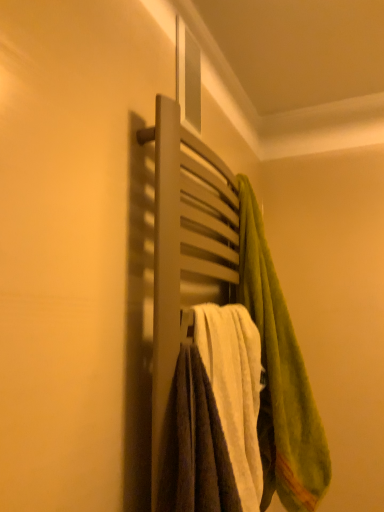
Identify the location of green fuzzy towel at upper right, acting as the 1th towel starting from the right. (280, 376).

What's the angular difference between green fuzzy towel at upper right, acting as the second towel starting from the left, and white soft towel at center, marked as the first towel in a left-to-right arrangement,'s facing directions?

green fuzzy towel at upper right, acting as the second towel starting from the left, and white soft towel at center, marked as the first towel in a left-to-right arrangement, are facing 0.000337 degrees away from each other.

Considering the relative positions of green fuzzy towel at upper right, acting as the second towel starting from the left, and white soft towel at center, marked as the first towel in a left-to-right arrangement, in the image provided, is green fuzzy towel at upper right, acting as the second towel starting from the left, to the left of white soft towel at center, marked as the first towel in a left-to-right arrangement, from the viewer's perspective?

In fact, green fuzzy towel at upper right, acting as the second towel starting from the left, is to the right of white soft towel at center, marked as the first towel in a left-to-right arrangement.

Considering the sizes of objects green fuzzy towel at upper right, acting as the 1th towel starting from the right, and white soft towel at center, marked as the first towel in a left-to-right arrangement, in the image provided, who is wider, green fuzzy towel at upper right, acting as the 1th towel starting from the right, or white soft towel at center, marked as the first towel in a left-to-right arrangement,?

green fuzzy towel at upper right, acting as the 1th towel starting from the right.

Identify the location of towel below the green fuzzy towel at upper right, acting as the second towel starting from the left (from the image's perspective). (234, 388).

In the scene shown: Does matte wooden towel rack at center have a greater width compared to white soft towel at center, marked as the first towel in a left-to-right arrangement?

In fact, matte wooden towel rack at center might be narrower than white soft towel at center, marked as the first towel in a left-to-right arrangement.

Between matte wooden towel rack at center and white soft towel at center, acting as the 2th towel starting from the right, which one has more height?

matte wooden towel rack at center is taller.

Is matte wooden towel rack at center at the left side of white soft towel at center, marked as the first towel in a left-to-right arrangement?

Indeed, matte wooden towel rack at center is positioned on the left side of white soft towel at center, marked as the first towel in a left-to-right arrangement.

Based on the photo, which of these two, white soft towel at center, marked as the first towel in a left-to-right arrangement, or matte wooden towel rack at center, is thinner?

With smaller width is matte wooden towel rack at center.

Which of these two, white soft towel at center, acting as the 2th towel starting from the right, or matte wooden towel rack at center, stands taller?

With more height is matte wooden towel rack at center.

Which object is more forward, white soft towel at center, marked as the first towel in a left-to-right arrangement, or matte wooden towel rack at center?

matte wooden towel rack at center is closer to the camera.

Is there a large distance between white soft towel at center, acting as the 2th towel starting from the right, and matte wooden towel rack at center?

No, white soft towel at center, acting as the 2th towel starting from the right, is not far away from matte wooden towel rack at center.

Does green fuzzy towel at upper right, acting as the second towel starting from the left, have a smaller size compared to matte wooden towel rack at center?

Yes.

From a real-world perspective, which object stands above the other?

In real-world perspective, matte wooden towel rack at center is above.

Which point is more forward, (266, 314) or (189, 203)?

The point (189, 203) is closer to the camera.

Looking at this image, is matte wooden towel rack at center located within green fuzzy towel at upper right, acting as the second towel starting from the left?

No, matte wooden towel rack at center is not inside green fuzzy towel at upper right, acting as the second towel starting from the left.

Is white soft towel at center, acting as the 2th towel starting from the right, oriented away from green fuzzy towel at upper right, acting as the 1th towel starting from the right?

white soft towel at center, acting as the 2th towel starting from the right, does not have its back to green fuzzy towel at upper right, acting as the 1th towel starting from the right.

Considering the sizes of white soft towel at center, acting as the 2th towel starting from the right, and green fuzzy towel at upper right, acting as the second towel starting from the left, in the image, is white soft towel at center, acting as the 2th towel starting from the right, wider or thinner than green fuzzy towel at upper right, acting as the second towel starting from the left,?

Clearly, white soft towel at center, acting as the 2th towel starting from the right, has less width compared to green fuzzy towel at upper right, acting as the second towel starting from the left.

From their relative heights in the image, would you say white soft towel at center, acting as the 2th towel starting from the right, is taller or shorter than green fuzzy towel at upper right, acting as the 1th towel starting from the right?

Clearly, white soft towel at center, acting as the 2th towel starting from the right, is shorter compared to green fuzzy towel at upper right, acting as the 1th towel starting from the right.

Is white soft towel at center, acting as the 2th towel starting from the right, to the left of green fuzzy towel at upper right, acting as the 1th towel starting from the right, from the viewer's perspective?

Yes, white soft towel at center, acting as the 2th towel starting from the right, is to the left of green fuzzy towel at upper right, acting as the 1th towel starting from the right.

Considering the relative sizes of matte wooden towel rack at center and green fuzzy towel at upper right, acting as the 1th towel starting from the right, in the image provided, is matte wooden towel rack at center bigger than green fuzzy towel at upper right, acting as the 1th towel starting from the right,?

Correct, matte wooden towel rack at center is larger in size than green fuzzy towel at upper right, acting as the 1th towel starting from the right.

Is matte wooden towel rack at center completely or partially outside of green fuzzy towel at upper right, acting as the 1th towel starting from the right?

Yes, matte wooden towel rack at center is located beyond the bounds of green fuzzy towel at upper right, acting as the 1th towel starting from the right.

Is matte wooden towel rack at center shorter than green fuzzy towel at upper right, acting as the second towel starting from the left?

Correct, matte wooden towel rack at center is not as tall as green fuzzy towel at upper right, acting as the second towel starting from the left.

You are a GUI agent. You are given a task and a screenshot of the screen. Output one action in this format:
    pyautogui.click(x=<x>, y=<y>)
    Task: Click on the towel on the right of white soft towel at center, acting as the 2th towel starting from the right
    The height and width of the screenshot is (512, 384).
    Given the screenshot: What is the action you would take?
    pyautogui.click(x=280, y=376)

Locate an element on the screen. This screenshot has width=384, height=512. towel that is the 2nd object located below the matte wooden towel rack at center (from the image's perspective) is located at coordinates pos(234,388).

Estimate the real-world distances between objects in this image. Which object is further from matte wooden towel rack at center, green fuzzy towel at upper right, acting as the second towel starting from the left, or white soft towel at center, marked as the first towel in a left-to-right arrangement?

green fuzzy towel at upper right, acting as the second towel starting from the left, lies further to matte wooden towel rack at center than the other object.

Which object lies further to the anchor point green fuzzy towel at upper right, acting as the second towel starting from the left, matte wooden towel rack at center or white soft towel at center, marked as the first towel in a left-to-right arrangement?

matte wooden towel rack at center is positioned further to the anchor green fuzzy towel at upper right, acting as the second towel starting from the left.

Estimate the real-world distances between objects in this image. Which object is closer to white soft towel at center, marked as the first towel in a left-to-right arrangement, green fuzzy towel at upper right, acting as the 1th towel starting from the right, or matte wooden towel rack at center?

green fuzzy towel at upper right, acting as the 1th towel starting from the right.

Considering their positions, is white soft towel at center, acting as the 2th towel starting from the right, positioned closer to matte wooden towel rack at center than green fuzzy towel at upper right, acting as the 1th towel starting from the right?

Among the two, white soft towel at center, acting as the 2th towel starting from the right, is located nearer to matte wooden towel rack at center.

Based on their spatial positions, is white soft towel at center, acting as the 2th towel starting from the right, or matte wooden towel rack at center further from green fuzzy towel at upper right, acting as the 1th towel starting from the right?

matte wooden towel rack at center is further to green fuzzy towel at upper right, acting as the 1th towel starting from the right.

Which object lies nearer to the anchor point white soft towel at center, acting as the 2th towel starting from the right, matte wooden towel rack at center or green fuzzy towel at upper right, acting as the second towel starting from the left?

green fuzzy towel at upper right, acting as the second towel starting from the left, is closer to white soft towel at center, acting as the 2th towel starting from the right.

Where is `towel between matte wooden towel rack at center and green fuzzy towel at upper right, acting as the second towel starting from the left, in the front-back direction`? towel between matte wooden towel rack at center and green fuzzy towel at upper right, acting as the second towel starting from the left, in the front-back direction is located at coordinates (234, 388).